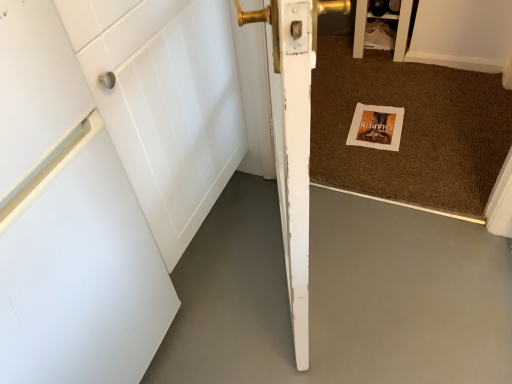
Identify the location of vacant area that is in front of white paper postcard at center. [395, 164].